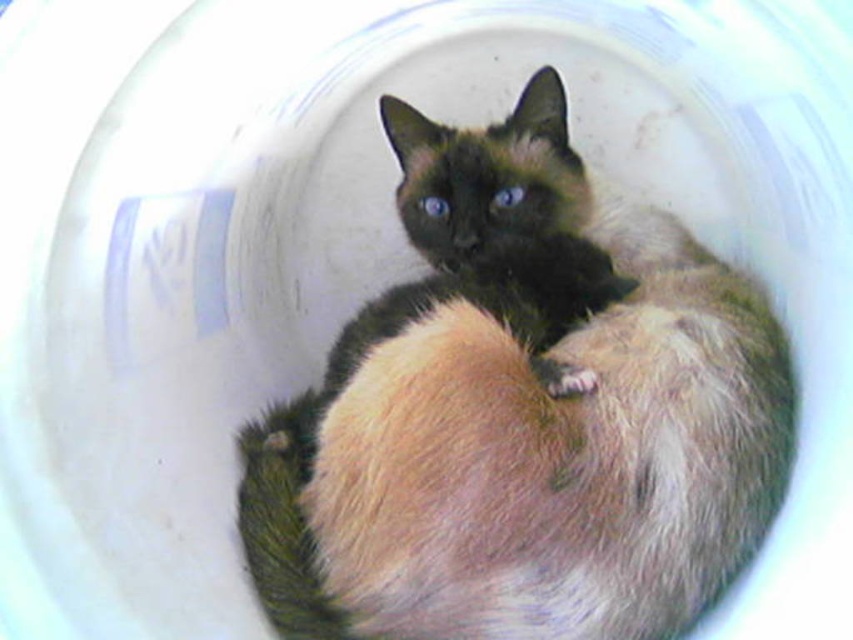
Question: Which of the following is the closest to the observer?

Choices:
 (A) silky fur cat at center
 (B) fuzzy fur paw at center

Answer: (A)

Question: Which object appears farthest from the camera in this image?

Choices:
 (A) silky fur cat at center
 (B) fuzzy fur paw at center

Answer: (B)

Question: Does silky fur cat at center appear on the right side of fuzzy fur paw at center?

Choices:
 (A) yes
 (B) no

Answer: (B)

Question: Is the position of silky fur cat at center less distant than that of fuzzy fur paw at center?

Choices:
 (A) yes
 (B) no

Answer: (A)

Question: Which of the following is the farthest from the observer?

Choices:
 (A) silky fur cat at center
 (B) fuzzy fur paw at center

Answer: (B)

Question: Does silky fur cat at center appear under fuzzy fur paw at center?

Choices:
 (A) no
 (B) yes

Answer: (A)